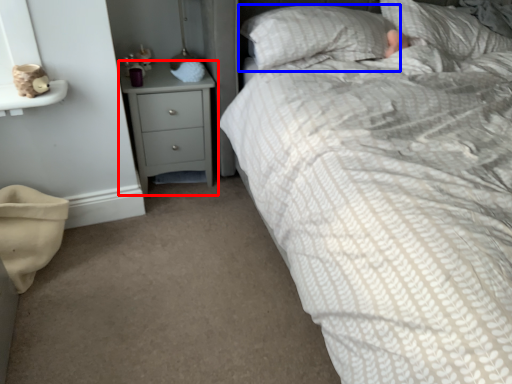
Question: Which point is further to the camera, chest of drawers (highlighted by a red box) or pillow (highlighted by a blue box)?

Choices:
 (A) chest of drawers
 (B) pillow

Answer: (A)